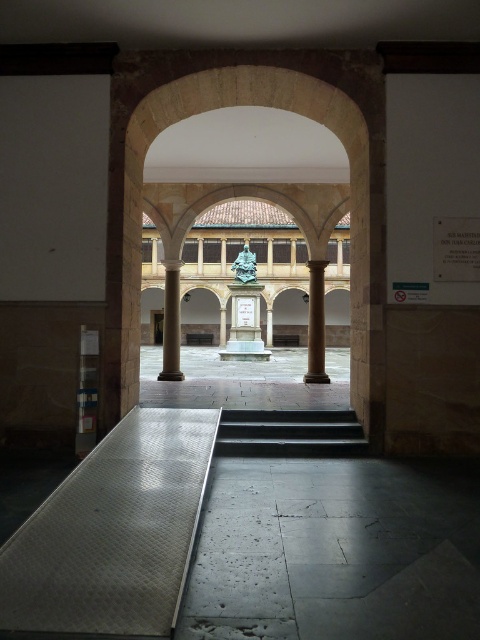
Question: Can you confirm if black polished stone stairs at center is wider than brown polished stone column at center?

Choices:
 (A) no
 (B) yes

Answer: (A)

Question: Is silver textured ramp at lower left bigger than brown polished stone column at center?

Choices:
 (A) no
 (B) yes

Answer: (A)

Question: Which of the following is the farthest from the observer?

Choices:
 (A) (254, 426)
 (B) (176, 317)
 (C) (310, 284)

Answer: (C)

Question: Among these points, which one is nearest to the camera?

Choices:
 (A) (167, 269)
 (B) (319, 266)

Answer: (B)

Question: Does silver textured ramp at lower left have a larger size compared to brown polished stone column at center?

Choices:
 (A) yes
 (B) no

Answer: (B)

Question: Which is nearer to the black polished stone stairs at center?

Choices:
 (A) smooth stone column at center
 (B) brown polished stone column at center

Answer: (B)